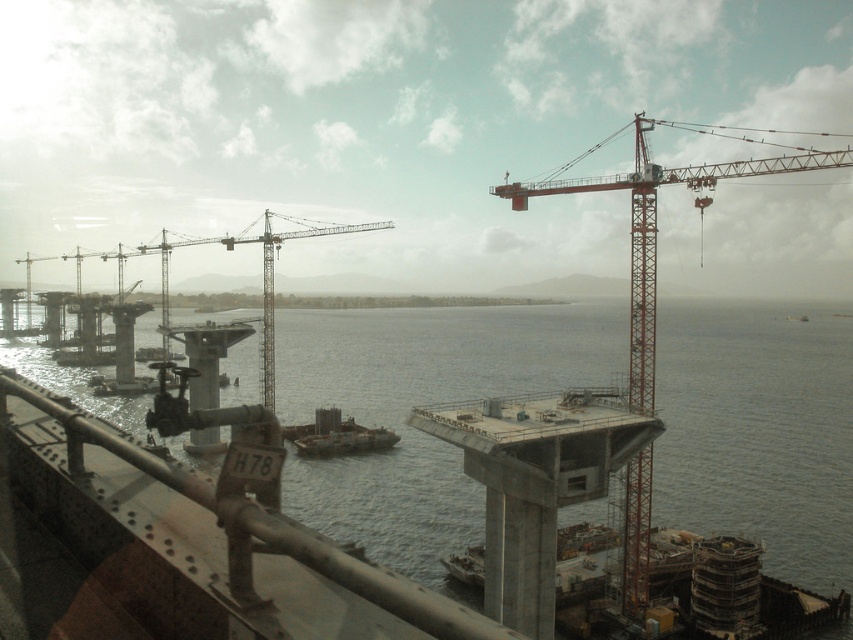
Question: Which of the following is the farthest from the observer?

Choices:
 (A) red metal crane at upper right
 (B) gray concrete water at center

Answer: (B)

Question: Can you confirm if rusty metal rail at lower left is wider than red metal crane at upper right?

Choices:
 (A) no
 (B) yes

Answer: (A)

Question: Which object appears closest to the camera in this image?

Choices:
 (A) red metal crane at upper right
 (B) rusty metal rail at lower left

Answer: (B)

Question: Is gray concrete water at center further to the viewer compared to red metal crane at upper right?

Choices:
 (A) yes
 (B) no

Answer: (A)

Question: Is gray concrete water at center in front of red metal crane at upper right?

Choices:
 (A) no
 (B) yes

Answer: (A)

Question: Based on their relative distances, which object is farther from the metallic gray boat at center?

Choices:
 (A) rusty metal rail at lower left
 (B) red metal crane at upper right

Answer: (A)